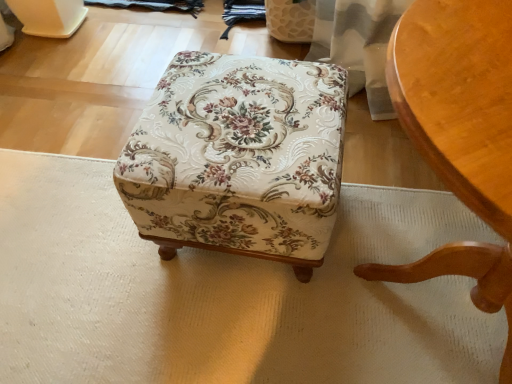
Question: Can you confirm if light brown wood chair at lower right is shorter than floral fabric ottoman at center?

Choices:
 (A) yes
 (B) no

Answer: (B)

Question: Is light brown wood chair at lower right not close to floral fabric ottoman at center?

Choices:
 (A) no
 (B) yes

Answer: (A)

Question: From a real-world perspective, is light brown wood chair at lower right physically above floral fabric ottoman at center?

Choices:
 (A) yes
 (B) no

Answer: (A)

Question: Considering the relative sizes of light brown wood chair at lower right and floral fabric ottoman at center in the image provided, is light brown wood chair at lower right wider than floral fabric ottoman at center?

Choices:
 (A) no
 (B) yes

Answer: (B)

Question: Is light brown wood chair at lower right further to camera compared to floral fabric ottoman at center?

Choices:
 (A) no
 (B) yes

Answer: (A)

Question: Is light brown wood chair at lower right looking in the opposite direction of floral fabric ottoman at center?

Choices:
 (A) no
 (B) yes

Answer: (A)

Question: Considering the relative sizes of floral fabric ottoman at center and light brown wood chair at lower right in the image provided, is floral fabric ottoman at center shorter than light brown wood chair at lower right?

Choices:
 (A) yes
 (B) no

Answer: (A)

Question: Does floral fabric ottoman at center have a greater height compared to light brown wood chair at lower right?

Choices:
 (A) no
 (B) yes

Answer: (A)

Question: From the image's perspective, is floral fabric ottoman at center below light brown wood chair at lower right?

Choices:
 (A) no
 (B) yes

Answer: (A)

Question: Is the surface of floral fabric ottoman at center in direct contact with light brown wood chair at lower right?

Choices:
 (A) no
 (B) yes

Answer: (A)

Question: From a real-world perspective, is floral fabric ottoman at center under light brown wood chair at lower right?

Choices:
 (A) yes
 (B) no

Answer: (A)

Question: Is floral fabric ottoman at center further to the viewer compared to light brown wood chair at lower right?

Choices:
 (A) yes
 (B) no

Answer: (A)

Question: Considering their positions, is light brown wood chair at lower right located in front of or behind floral fabric ottoman at center?

Choices:
 (A) front
 (B) behind

Answer: (A)